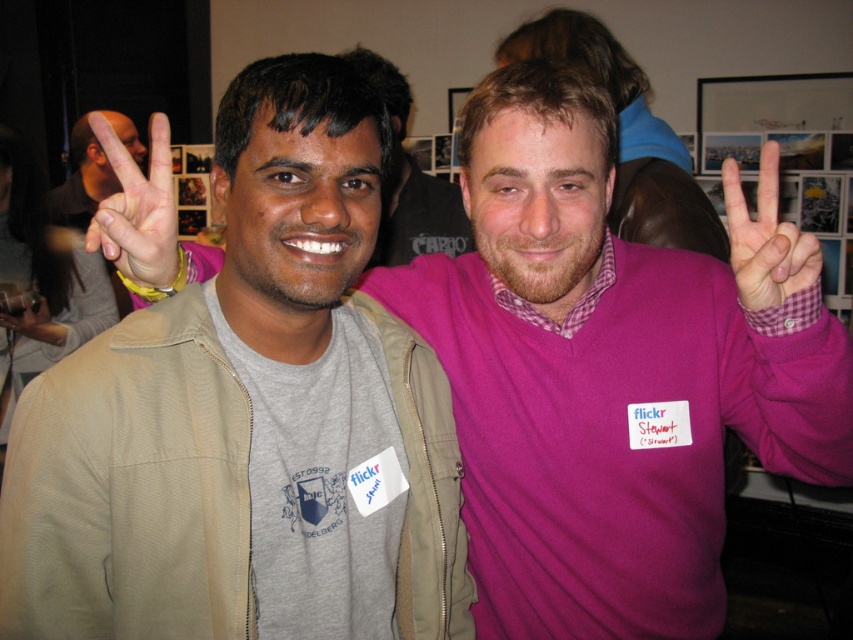
You are a photographer at the event and need to adjust the camera settings to capture both the matte gray sweatshirt at left and the matte black hand at upper left in focus. The camera has a depth of field that can cover objects within 2 meters of each other. Will both objects be in focus?

The distance between the matte gray sweatshirt at left and the matte black hand at upper left is 2.26 meters. Since the depth of field can only cover 2 meters, the objects are too far apart to both be in focus.

You are at a social gathering and see two people making peace signs. The person on the left is wearing a light gray tshirt under a beige jacket, and the person on the right is wearing a bright pink sweater over a checkered shirt. There is a point at coordinates (136, 205). What object is located at that point?

The point at coordinates (136, 205) corresponds to the matte skin hand at center.

You are at a social event and see two hands in front of you, the matte skin hand at center and the pink fabric hand at right. Which hand is closer to your left side?

The matte skin hand at center is closer to your left side because it is positioned to the left of the pink fabric hand at right.